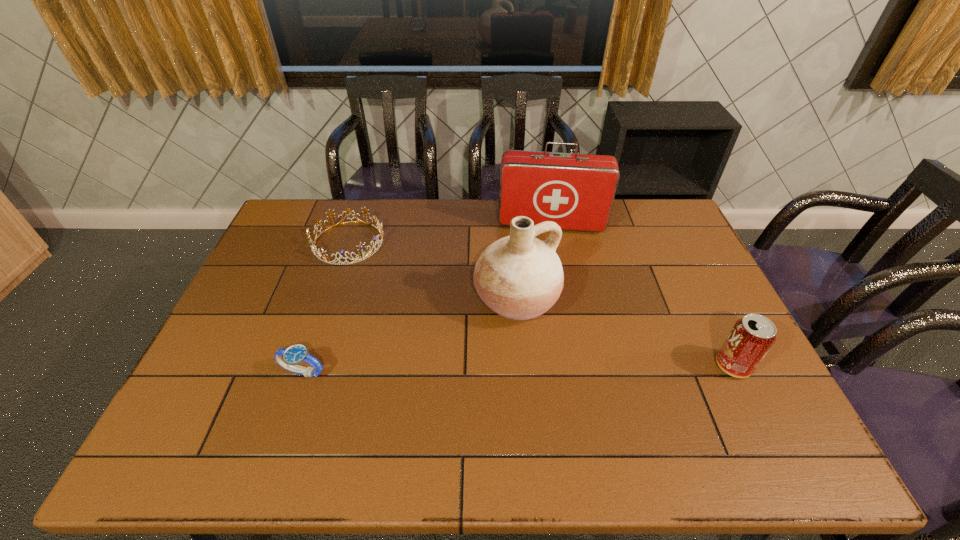
You are a GUI agent. You are given a task and a screenshot of the screen. Output one action in this format:
    pyautogui.click(x=<x>, y=<y>)
    Task: Click on the watch
    
    Given the screenshot: What is the action you would take?
    pyautogui.click(x=289, y=358)

Locate an element on the screen. soda can is located at coordinates [x=752, y=336].

Where is `the third shortest object`? the third shortest object is located at coordinates (752, 336).

The height and width of the screenshot is (540, 960). I want to click on pottery, so click(519, 277).

What are the coordinates of `the first-aid kit` in the screenshot? It's located at 576,191.

Where is `tiara`? The image size is (960, 540). tiara is located at coordinates (321, 252).

This screenshot has width=960, height=540. In order to click on vacant area situated 0.340m on the back of the watch in this screenshot , I will do `click(336, 274)`.

Identify the location of vacant region located on the left of the third tallest object. This screenshot has height=540, width=960. (594, 366).

Image resolution: width=960 pixels, height=540 pixels. Identify the location of free region located 0.090m to pour from the handle of the pottery. (558, 353).

In order to click on vacant space located to pour from the handle of the pottery in this screenshot , I will do `click(589, 393)`.